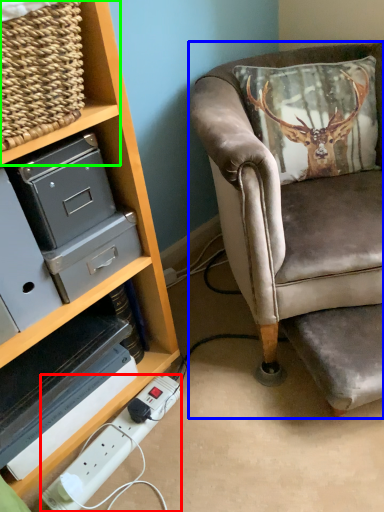
Question: Based on their relative distances, which object is nearer to extension cord (highlighted by a red box)? Choose from chair (highlighted by a blue box) and shelf (highlighted by a green box).

Choices:
 (A) chair
 (B) shelf

Answer: (A)